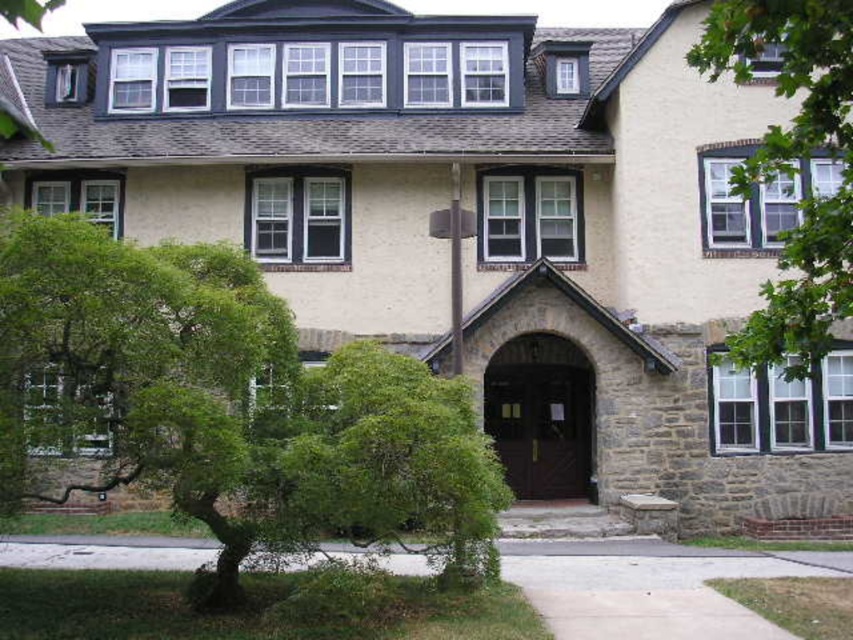
Between green leafy tree at left and green leafy tree at upper right, which one appears on the right side from the viewer's perspective?

green leafy tree at upper right

Does green leafy tree at left appear over green leafy tree at upper right?

Incorrect, green leafy tree at left is not positioned above green leafy tree at upper right.

Between point (254, 362) and point (715, 49), which one is positioned in front?

Point (715, 49) is more forward.

Identify the location of green leafy tree at left. (225, 403).